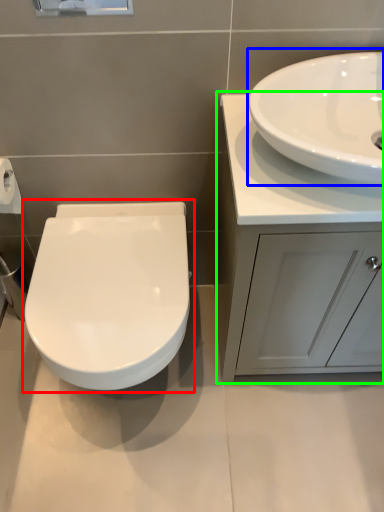
Question: Considering the real-world distances, which object is closest to toilet (highlighted by a red box)? sink (highlighted by a blue box) or bathroom cabinet (highlighted by a green box).

Choices:
 (A) sink
 (B) bathroom cabinet

Answer: (B)